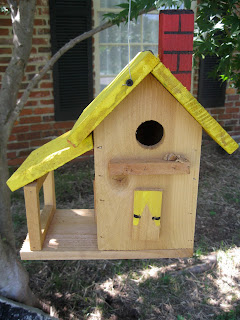
This screenshot has width=240, height=320. I want to click on window shutters, so click(74, 83), click(206, 83).